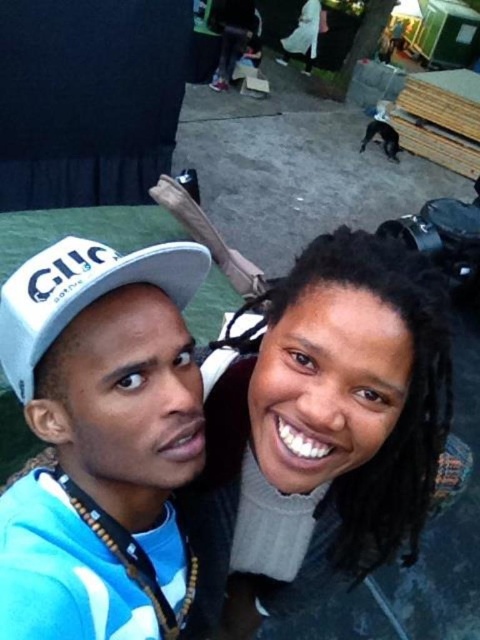
Which is more to the right, smooth gray sweater at center or white matte baseball cap at upper left?

smooth gray sweater at center

Between point (331, 280) and point (79, 276), which one is positioned behind?

The point (331, 280) is behind.

The width and height of the screenshot is (480, 640). What do you see at coordinates (321, 435) in the screenshot? I see `smooth gray sweater at center` at bounding box center [321, 435].

The height and width of the screenshot is (640, 480). I want to click on smooth gray sweater at center, so click(321, 435).

Between white matte cap at upper left and white matte baseball cap at upper left, which one has more height?

white matte cap at upper left

Looking at this image, which of these two, white matte cap at upper left or white matte baseball cap at upper left, stands shorter?

Standing shorter between the two is white matte baseball cap at upper left.

Does point (60, 396) come behind point (48, 346)?

Yes, point (60, 396) is farther from viewer.

Find the location of a particular element. The width and height of the screenshot is (480, 640). white matte cap at upper left is located at coordinates (100, 440).

Who is shorter, smooth gray sweater at center or white matte cap at upper left?

white matte cap at upper left is shorter.

Does point (260, 596) come behind point (163, 637)?

Yes, it is behind point (163, 637).

Is point (309, 435) more distant than point (173, 273)?

No, (309, 435) is closer to viewer.

You are a GUI agent. You are given a task and a screenshot of the screen. Output one action in this format:
    pyautogui.click(x=<x>, y=<y>)
    Task: Click on the smooth gray sweater at center
    
    Given the screenshot: What is the action you would take?
    pyautogui.click(x=321, y=435)